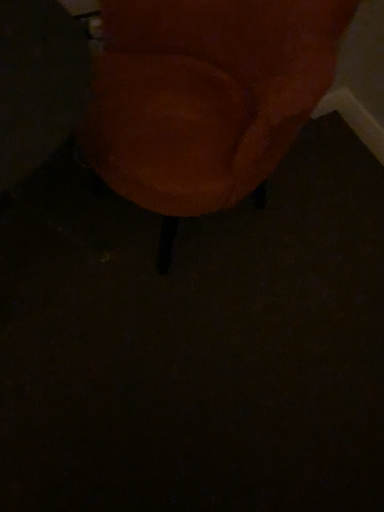
Question: Should I look upward or downward to see orange fabric chair at center?

Choices:
 (A) down
 (B) up

Answer: (B)